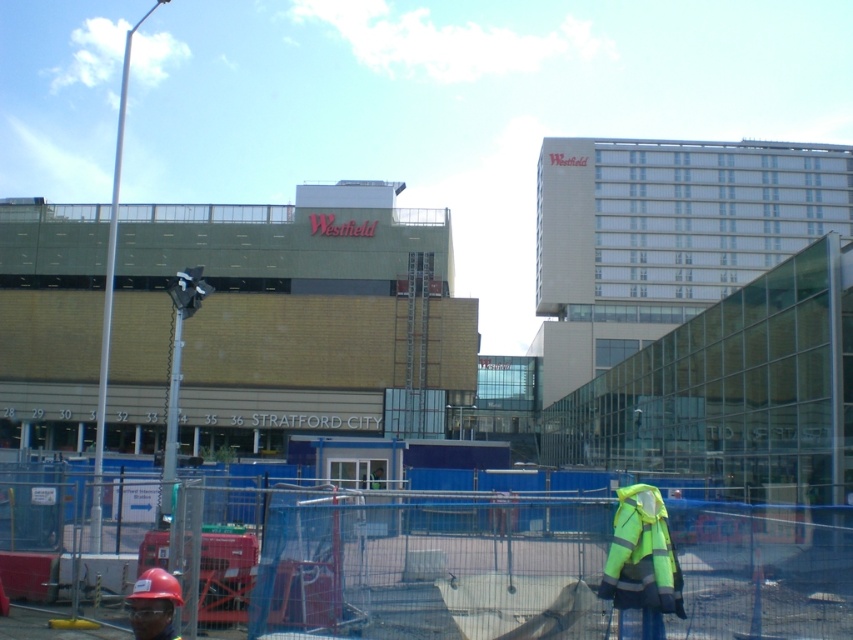
Question: Is blue mesh fence at lower center positioned behind neon yellow reflective vest at lower right?

Choices:
 (A) yes
 (B) no

Answer: (A)

Question: Is blue mesh fence at lower center to the left of neon yellow reflective vest at lower right from the viewer's perspective?

Choices:
 (A) no
 (B) yes

Answer: (B)

Question: Which point is farther from the camera taking this photo?

Choices:
 (A) (756, 504)
 (B) (619, 545)

Answer: (A)

Question: Which of the following is the closest to the observer?

Choices:
 (A) blue mesh fence at lower center
 (B) neon yellow reflective vest at lower right

Answer: (B)

Question: Which of the following is the farthest from the observer?

Choices:
 (A) (345, 572)
 (B) (627, 554)

Answer: (A)

Question: Does blue mesh fence at lower center appear over neon yellow reflective vest at lower right?

Choices:
 (A) yes
 (B) no

Answer: (B)